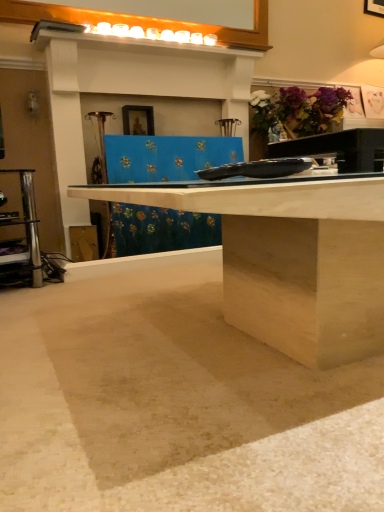
What is the approximate height of beige matte concrete at lower center?

beige matte concrete at lower center is 1.35 inches in height.

I want to click on wooden framed picture at upper center, so click(138, 120).

Image resolution: width=384 pixels, height=512 pixels. Describe the element at coordinates (301, 110) in the screenshot. I see `purple matte flower at upper right` at that location.

Locate an element on the screen. The image size is (384, 512). beige matte concrete at lower center is located at coordinates (174, 405).

Is wooden framed picture at upper center spatially inside beige matte concrete at lower center, or outside of it?

wooden framed picture at upper center is not enclosed by beige matte concrete at lower center.

Does wooden framed picture at upper center have a greater width compared to beige matte concrete at lower center?

No.

Based on their sizes in the image, would you say wooden framed picture at upper center is bigger or smaller than beige matte concrete at lower center?

In the image, wooden framed picture at upper center appears to be smaller than beige matte concrete at lower center.

How many degrees apart are the facing directions of wooden framed picture at upper center and beige matte concrete at lower center?

The angular difference between wooden framed picture at upper center and beige matte concrete at lower center is 90.2 degrees.

From a real-world perspective, is wooden framed picture at upper center physically located above or below purple matte flower at upper right?

wooden framed picture at upper center is below purple matte flower at upper right.

Can you confirm if wooden framed picture at upper center is positioned to the right of purple matte flower at upper right?

No.

Is wooden framed picture at upper center looking in the opposite direction of purple matte flower at upper right?

That's not correct — wooden framed picture at upper center is not looking away from purple matte flower at upper right.

From the image's perspective, does beige matte concrete at lower center appear lower than purple matte flower at upper right?

Yes.

Considering the points (56, 452) and (331, 97), which point is behind, point (56, 452) or point (331, 97)?

The point (331, 97) is more distant.

Is beige matte concrete at lower center looking in the opposite direction of purple matte flower at upper right?

No, beige matte concrete at lower center is not facing away from purple matte flower at upper right.

Is beige matte concrete at lower center inside or outside of purple matte flower at upper right?

beige matte concrete at lower center is located beyond the bounds of purple matte flower at upper right.

In the image, there is a purple matte flower at upper right. At what (x,y) coordinates should I click in order to perform the action: click on picture frame below it (from the image's perspective). Please return your answer as a coordinate pair (x, y). This screenshot has width=384, height=512. Looking at the image, I should click on (138, 120).

Can you tell me how much purple matte flower at upper right and wooden framed picture at upper center differ in facing direction?

0.797 degrees.

From the image's perspective, is purple matte flower at upper right located above or below wooden framed picture at upper center?

Based on their image positions, purple matte flower at upper right is located above wooden framed picture at upper center.

Does point (267, 121) appear closer or farther from the camera than point (261, 443)?

Point (267, 121) is positioned farther from the camera compared to point (261, 443).

Which of these two, purple matte flower at upper right or beige matte concrete at lower center, stands shorter?

beige matte concrete at lower center.

How different are the orientations of purple matte flower at upper right and beige matte concrete at lower center in degrees?

There is a 89.4-degree angle between the facing directions of purple matte flower at upper right and beige matte concrete at lower center.

Between purple matte flower at upper right and beige matte concrete at lower center, which one is positioned behind?

purple matte flower at upper right is further from the camera.

Is beige matte concrete at lower center positioned with its back to wooden framed picture at upper center?

beige matte concrete at lower center is not turned away from wooden framed picture at upper center.

Is beige matte concrete at lower center positioned in front of wooden framed picture at upper center?

Yes, it is.

Locate an element on the screen. Image resolution: width=384 pixels, height=512 pixels. picture frame on the left of beige matte concrete at lower center is located at coordinates (138, 120).

What are the coordinates of `picture frame that appears on the left of beige matte concrete at lower center` in the screenshot? It's located at (138, 120).

This screenshot has width=384, height=512. I want to click on picture frame below the purple matte flower at upper right (from the image's perspective), so click(138, 120).

Based on the photo, looking at the image, which one is located further to purple matte flower at upper right, beige matte concrete at lower center or wooden framed picture at upper center?

Among the two, beige matte concrete at lower center is located further to purple matte flower at upper right.

Based on their spatial positions, is purple matte flower at upper right or beige matte concrete at lower center further from wooden framed picture at upper center?

beige matte concrete at lower center.

Considering their positions, is wooden framed picture at upper center positioned closer to beige matte concrete at lower center than purple matte flower at upper right?

Among the two, wooden framed picture at upper center is located nearer to beige matte concrete at lower center.

Considering their positions, is purple matte flower at upper right positioned closer to beige matte concrete at lower center than wooden framed picture at upper center?

wooden framed picture at upper center.

Estimate the real-world distances between objects in this image. Which object is further from purple matte flower at upper right, wooden framed picture at upper center or beige matte concrete at lower center?

beige matte concrete at lower center is further to purple matte flower at upper right.

Which object lies nearer to the anchor point wooden framed picture at upper center, beige matte concrete at lower center or purple matte flower at upper right?

purple matte flower at upper right is closer to wooden framed picture at upper center.

Locate an element on the screen. The image size is (384, 512). picture frame positioned between beige matte concrete at lower center and purple matte flower at upper right from near to far is located at coordinates (138, 120).